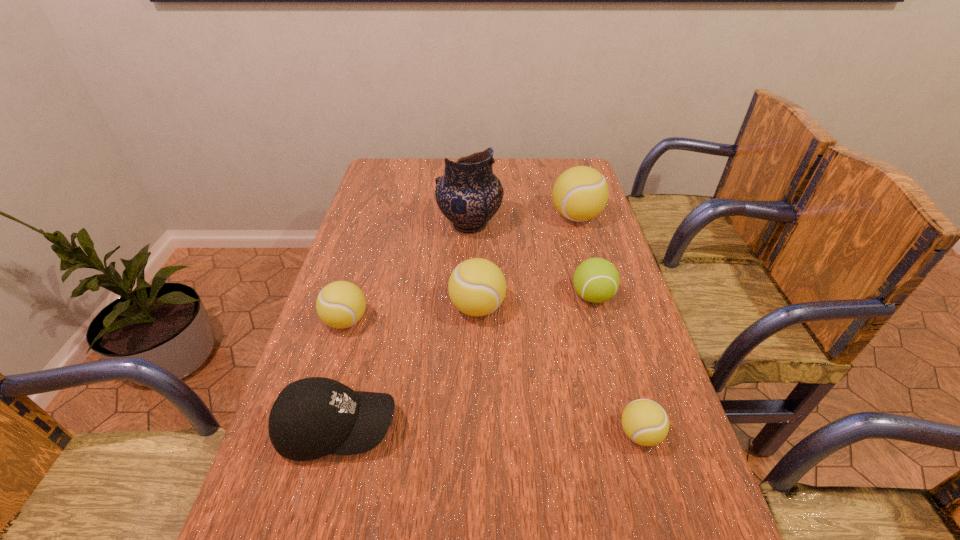
You are a GUI agent. You are given a task and a screenshot of the screen. Output one action in this format:
    pyautogui.click(x=<x>, y=<y>)
    Task: Click on the vacant region between the green tennis ball and the black baseball cap
    This screenshot has height=540, width=960.
    Given the screenshot: What is the action you would take?
    pyautogui.click(x=465, y=362)

Where is `object that can be found as the fifth closest to the tallest object`? The height and width of the screenshot is (540, 960). object that can be found as the fifth closest to the tallest object is located at coordinates (313, 417).

The height and width of the screenshot is (540, 960). In order to click on object that is the third closest to the baseball cap in this screenshot , I will do `click(645, 422)`.

Select which tennis ball appears as the second closest to the green tennis ball. Please provide its 2D coordinates. Your answer should be formatted as a tuple, i.e. [(x, y)], where the tuple contains the x and y coordinates of a point satisfying the conditions above.

[(580, 193)]

Image resolution: width=960 pixels, height=540 pixels. Identify the location of the third closest tennis ball to the black baseball cap. (645, 422).

Locate an element on the screen. The width and height of the screenshot is (960, 540). the third closest yellow tennis ball to the shortest object is located at coordinates (580, 193).

Find the location of a particular element. the third closest yellow tennis ball to the pottery is located at coordinates (341, 304).